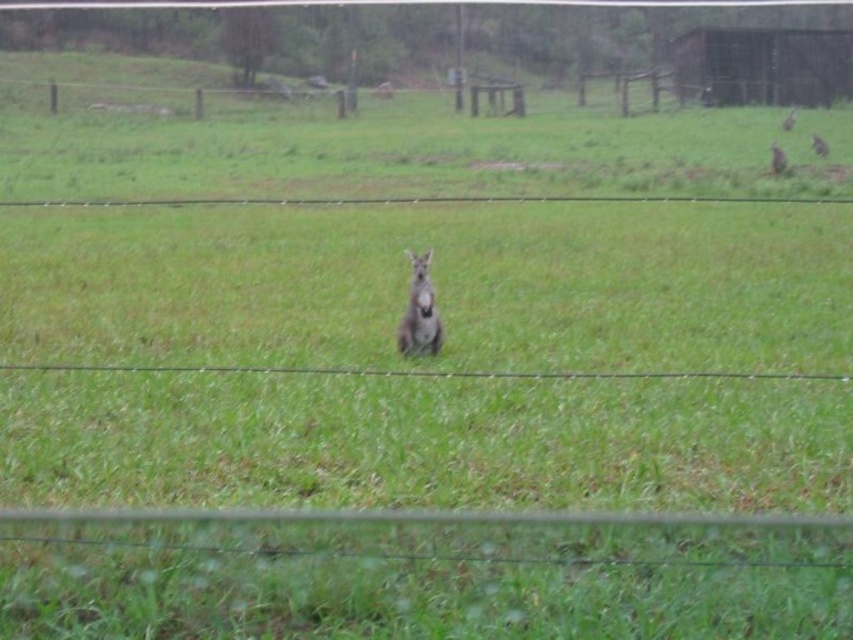
You are standing in a grassy field and see the fuzzy gray kangaroo at center. If you want to approach it without getting too close, what is the minimum distance you should keep to stay at least 10 feet away?

The fuzzy gray kangaroo at center is 30.92 feet away from the viewer. To stay at least 10 feet away, you should keep a minimum distance of 40.92 feet between yourself and the kangaroo.

You are a photographer aiming to capture the fuzzy gray kangaroo at center in the image. Based on the scene description, where should you position your camera to ensure the kangaroo is centered in your shot?

The fuzzy gray kangaroo at center is already positioned at the center of the image, at coordinates approximately point (416, 313). To keep it centered, the camera should remain aligned with this central point.

You are a wildlife photographer aiming to capture a closeup shot of the fuzzy gray kangaroo at center. Your camera has a maximum zoom range of 10 meters. Can you get a clear closeup without moving closer?

The fuzzy gray kangaroo at center is 9.42 meters away from the camera. Since the camera can zoom up to 10 meters, it is within range. Therefore, you can get a clear closeup without moving closer.